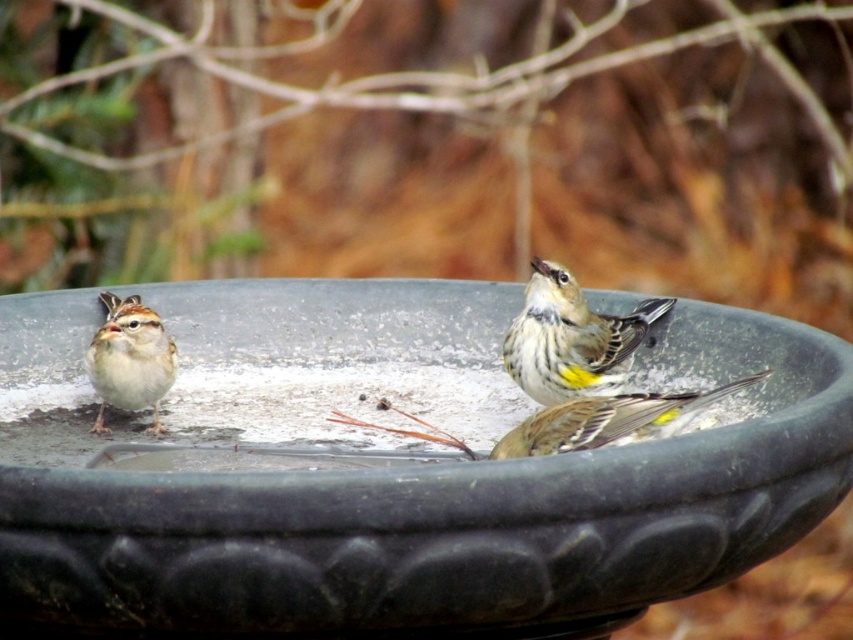
You are standing in front of the birdbath and want to determine which of the two points, point (x=595, y=385) or point (x=119, y=304), is nearer to you. Based on the spatial relationship between them, which point is closer?

Point (x=595, y=385) is closer to the viewer than point (x=119, y=304).